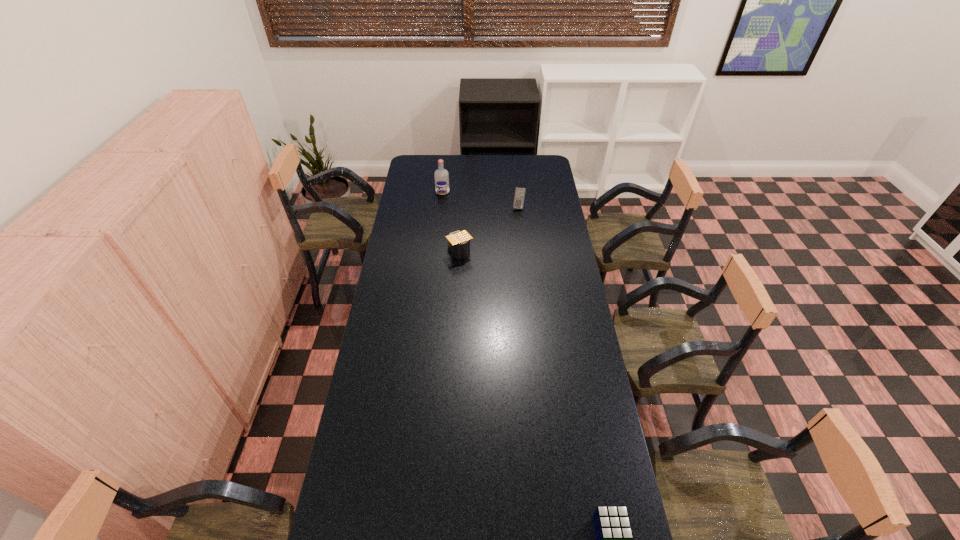
Identify which calculator is located as the second nearest to the tallest object. Please provide its 2D coordinates. Your answer should be formatted as a tuple, i.e. [(x, y)], where the tuple contains the x and y coordinates of a point satisfying the conditions above.

[(458, 242)]

The width and height of the screenshot is (960, 540). In order to click on free location that satisfies the following two spatial constraints: 1. on the label of the third object from right to left; 2. on the left side of the tallest object in this screenshot , I will do `click(437, 252)`.

The image size is (960, 540). I want to click on blank area in the image that satisfies the following two spatial constraints: 1. on the label of the farthest object; 2. on the left side of the left calculator, so click(437, 252).

Find the location of a particular element. free spot that satisfies the following two spatial constraints: 1. on the label of the farthest object; 2. on the left side of the third object from right to left is located at coordinates (437, 252).